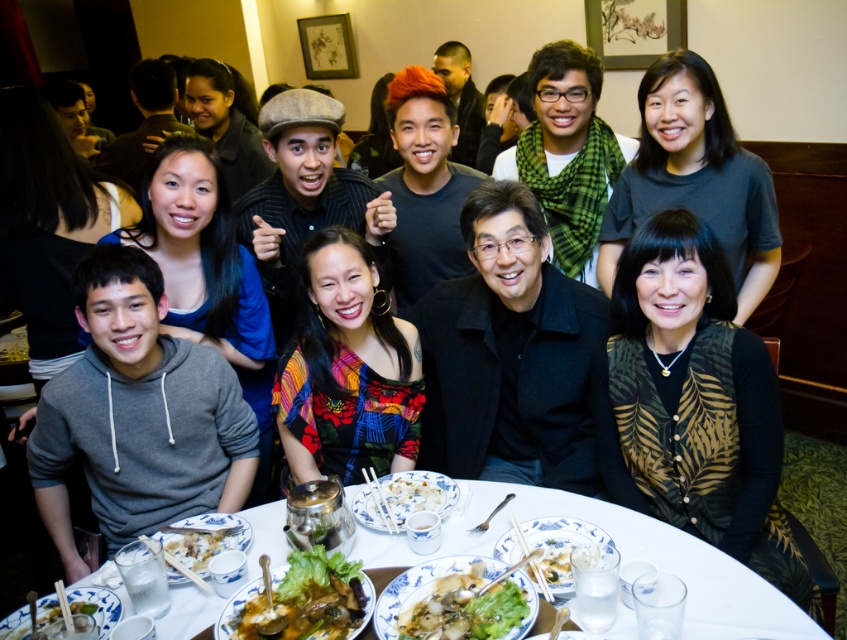
Who is positioned more to the left, white porcelain platter at center or white glossy rice bowl at center?

white glossy rice bowl at center is more to the left.

Is white porcelain platter at center to the left of white glossy rice bowl at center from the viewer's perspective?

In fact, white porcelain platter at center is to the right of white glossy rice bowl at center.

Who is more distant from viewer, (x=552, y=582) or (x=397, y=516)?

The point (x=397, y=516) is behind.

Find the location of `white porcelain platter at center`. white porcelain platter at center is located at coordinates (560, 547).

Who is taller, white porcelain table at center or green leafy vegetable at center?

white porcelain table at center is taller.

Which is in front, point (163, 634) or point (502, 577)?

Point (502, 577) is more forward.

Between point (630, 509) and point (464, 618), which one is positioned in front?

Point (464, 618) is in front.

I want to click on white porcelain table at center, so click(621, 557).

Between white porcelain table at center and white glossy rice bowl at center, which one has more height?

white porcelain table at center is taller.

Is white porcelain table at center positioned behind white glossy rice bowl at center?

No, white porcelain table at center is closer to the viewer.

Which is behind, point (652, 524) or point (416, 493)?

Point (416, 493)

The image size is (847, 640). Identify the location of white porcelain table at center. (621, 557).